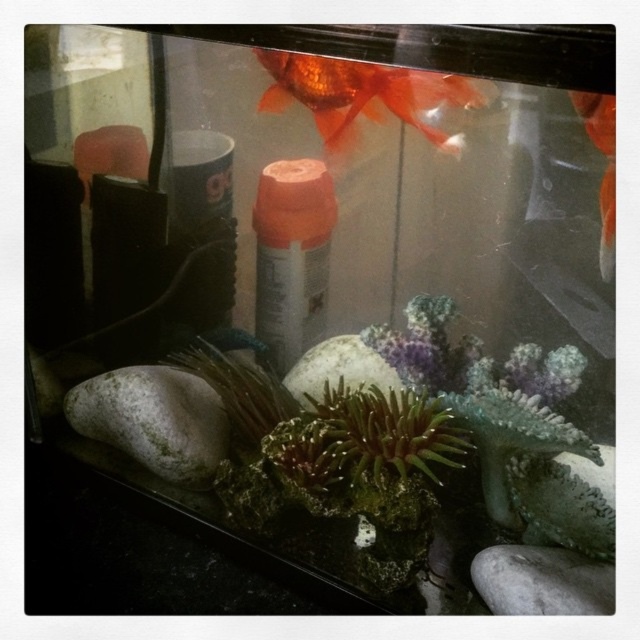
Between white matte rock at center and orange glossy goldfish at upper right, which one appears on the left side from the viewer's perspective?

white matte rock at center is more to the left.

Based on the photo, does white matte rock at center appear on the left side of orange glossy goldfish at upper right?

Indeed, white matte rock at center is positioned on the left side of orange glossy goldfish at upper right.

Between point (360, 371) and point (598, 148), which one is positioned behind?

Positioned behind is point (360, 371).

Identify the location of white matte rock at center. (339, 369).

Who is shorter, green spiky anemone at center or white matte rock at center-left?

Standing shorter between the two is green spiky anemone at center.

Find the location of `green spiky anemone at center`. green spiky anemone at center is located at coordinates (365, 436).

In order to click on green spiky anemone at center in this screenshot , I will do click(365, 436).

Does white matte rock at center-left appear under shiny orange fish at upper center?

Yes.

Is point (97, 380) in front of point (340, 148)?

No, (97, 380) is further to viewer.

Who is more distant from viewer, (150, 467) or (266, 100)?

Point (150, 467)

This screenshot has width=640, height=640. What are the coordinates of `white matte rock at center-left` in the screenshot? It's located at (154, 420).